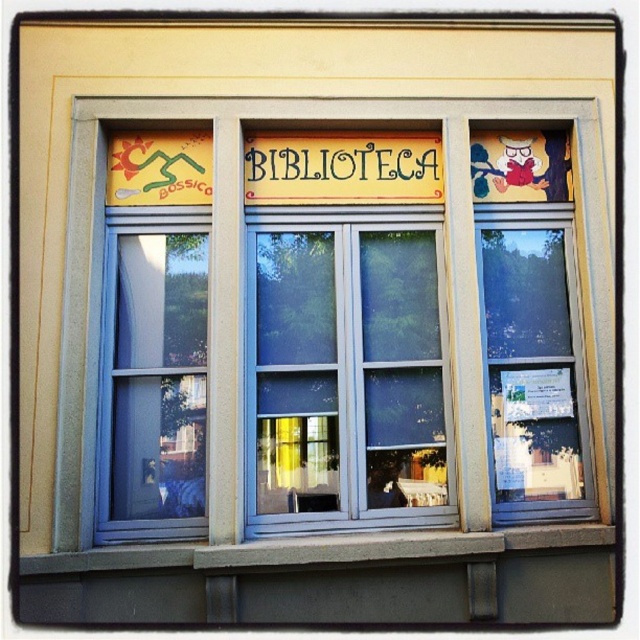
You are a window installer who needs to replace the smaller of the two windows. Which window should you choose between the clear glass window at center and the blue glass window at left?

The blue glass window at left is smaller than the clear glass window at center, so you should choose the blue glass window at left to replace.

You are an architect designing a new library and want to replicate the window design shown. Which of the two windows, the clear glass window at center or the blue glass window at left, should you make taller to match the original design?

The blue glass window at left should be made taller than the clear glass window at center to match the original design, as the clear glass window at center is not as tall as the blue glass window at left.

You are a window installer who needs to replace the blue glass window at left and the yellow painted wood sign at center. According to the current setup, which object is positioned lower?

The blue glass window at left is positioned lower than the yellow painted wood sign at center.